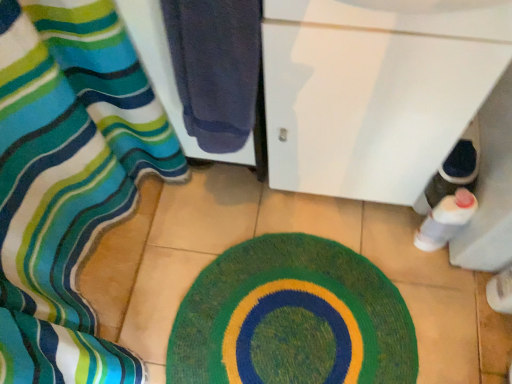
Find the location of a particular element. The image size is (512, 384). free point to the left of white glossy bottle at lower right is located at coordinates (376, 234).